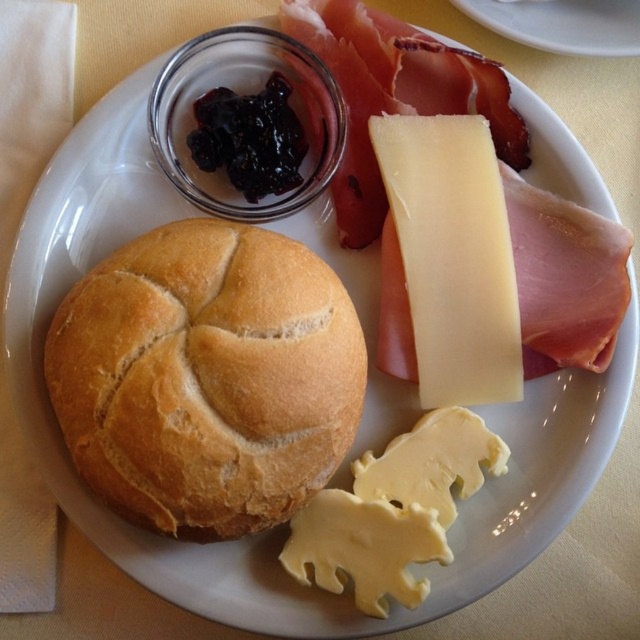
Does golden brown crusty loaf at center appear on the right side of white smooth cheese at upper right?

In fact, golden brown crusty loaf at center is to the left of white smooth cheese at upper right.

Identify the location of golden brown crusty loaf at center. This screenshot has width=640, height=640. point(205,378).

Where is `white smooth cheese at upper right`? Image resolution: width=640 pixels, height=640 pixels. white smooth cheese at upper right is located at coordinates (452, 256).

Between white smooth cheese at upper right and yellowish smooth cheese at lower center, which one appears on the left side from the viewer's perspective?

yellowish smooth cheese at lower center is more to the left.

What do you see at coordinates (452, 256) in the screenshot? I see `white smooth cheese at upper right` at bounding box center [452, 256].

At what (x,y) coordinates should I click in order to perform the action: click on white smooth cheese at upper right. Please return your answer as a coordinate pair (x, y). Looking at the image, I should click on (452, 256).

Who is shorter, golden brown crusty loaf at center or yellowish smooth cheese at lower center?

yellowish smooth cheese at lower center

Can you confirm if golden brown crusty loaf at center is wider than yellowish smooth cheese at lower center?

Yes.

Identify the location of golden brown crusty loaf at center. (205, 378).

This screenshot has height=640, width=640. Identify the location of golden brown crusty loaf at center. (205, 378).